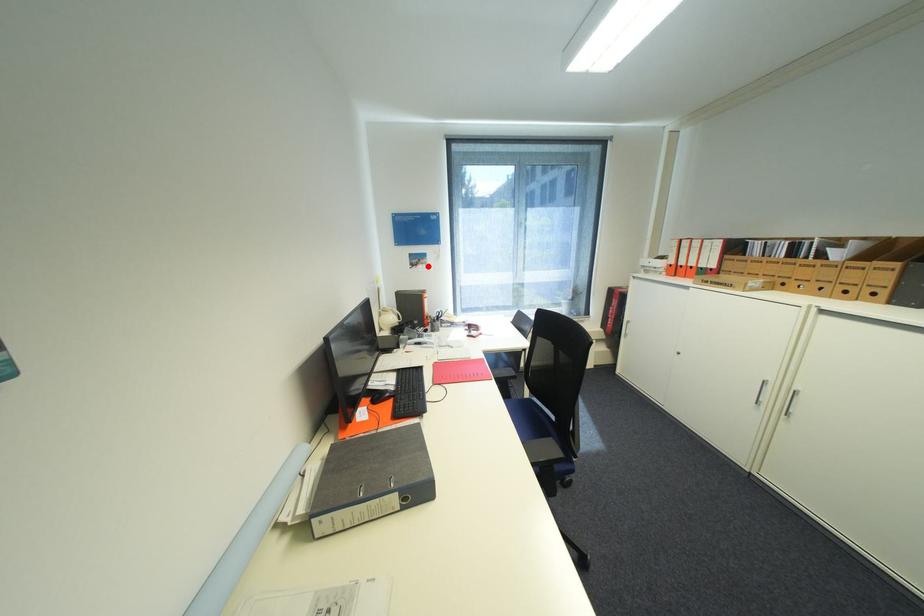
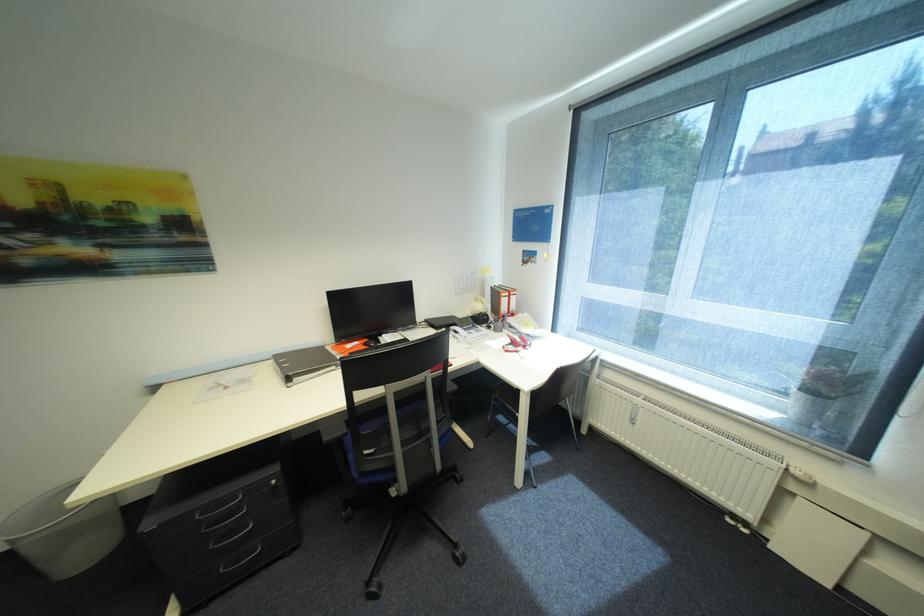
The point at the highlighted location is marked in the first image. Where is the corresponding point in the second image?

(537, 265)